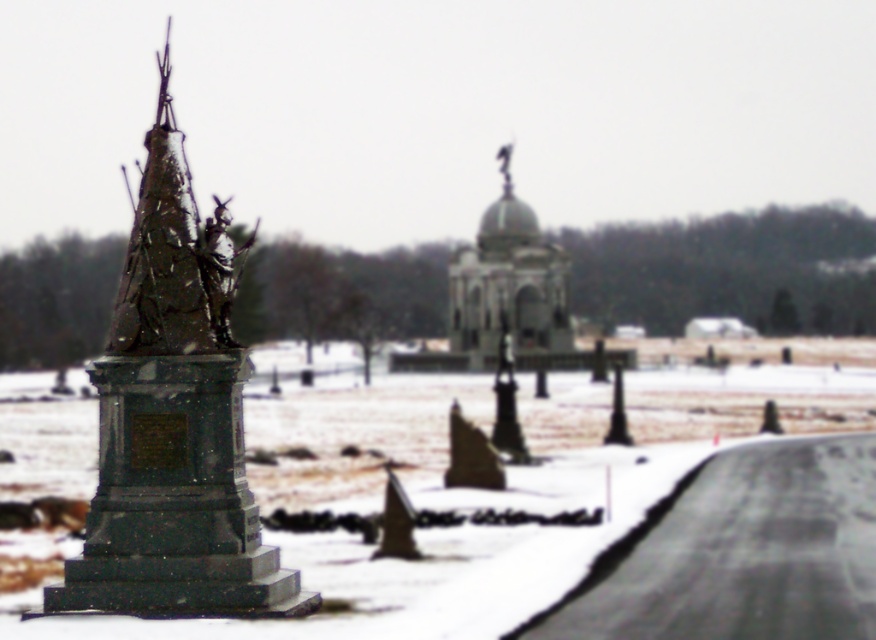
You are a tour guide explaining the monuments in the snowy landscape. Which object is bigger between the bronze statue at left and the smooth gray dome at center?

The bronze statue at left is larger in size compared to the smooth gray dome at center.

Based on the photo, you are a photographer planning to capture both the bronze statue at left and the smooth gray dome at center in a single frame. Based on their sizes, which object should you focus on first to ensure both are visible in your composition?

The bronze statue at left is much taller than the smooth gray dome at center, so you should focus on the bronze statue at left first to ensure both are visible in the composition.

You are an art student analyzing the spatial relationships in the image. You need to determine which object occupies more horizontal space. Based on the scene, which object is wider between the bronze statue at left and the smooth gray dome at center?

The bronze statue at left is wider than the smooth gray dome at center according to the description.